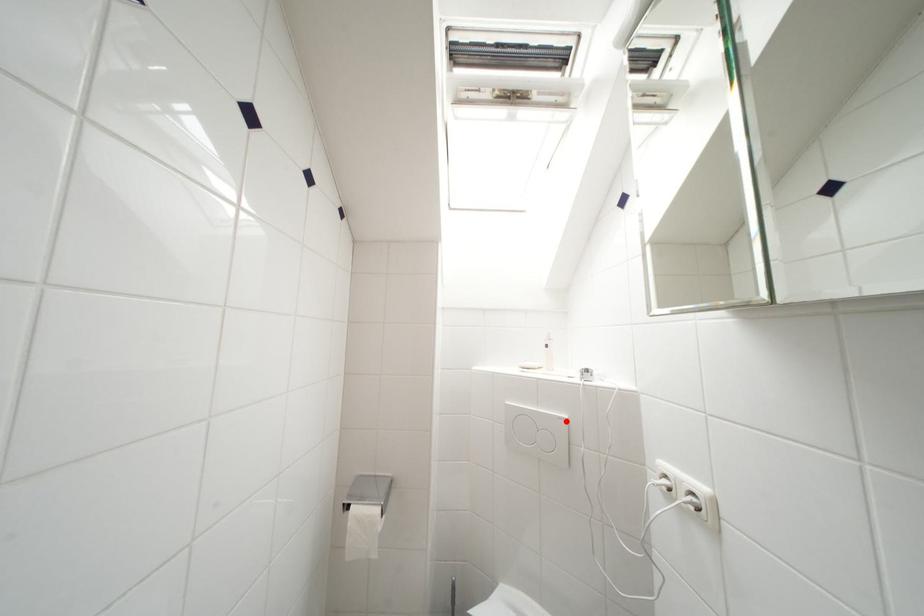
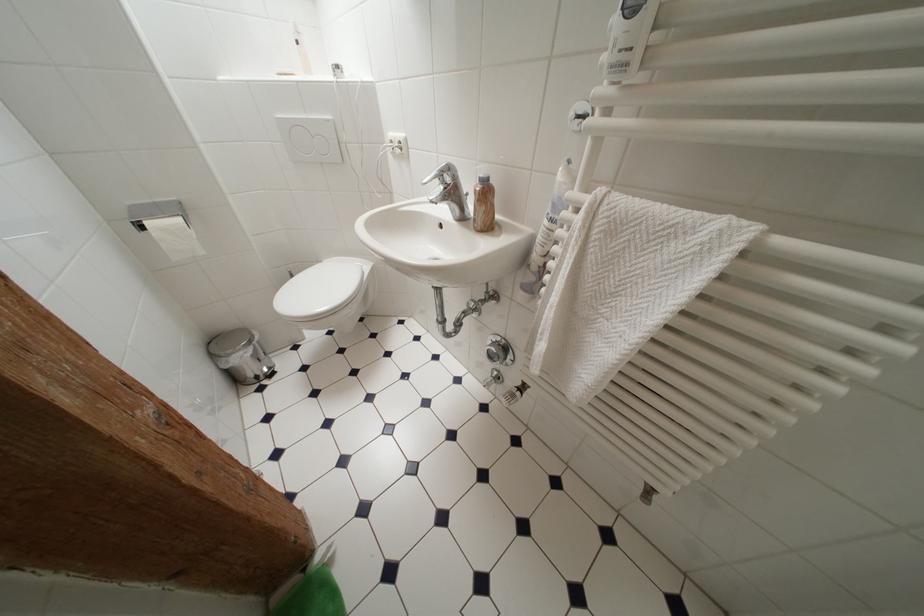
In the second image, find the point that corresponds to the highlighted location in the first image.

(333, 124)